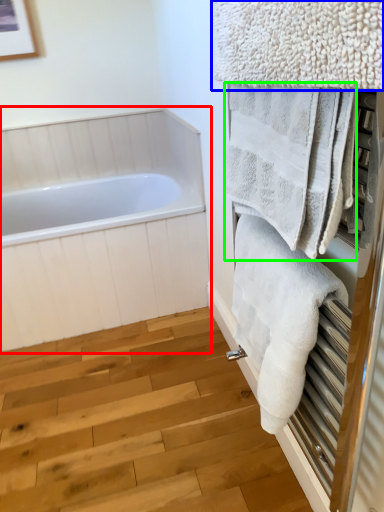
Question: Which object is positioned farthest from bathtub (highlighted by a red box)? Select from towel (highlighted by a blue box) and towel (highlighted by a green box).

Choices:
 (A) towel
 (B) towel

Answer: (A)